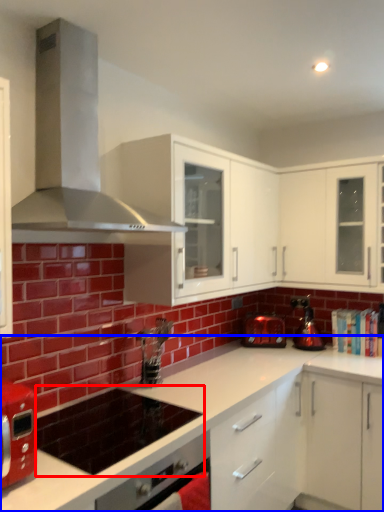
Question: Which object is closer to the camera taking this photo, appliance (highlighted by a red box) or countertop (highlighted by a blue box)?

Choices:
 (A) appliance
 (B) countertop

Answer: (B)